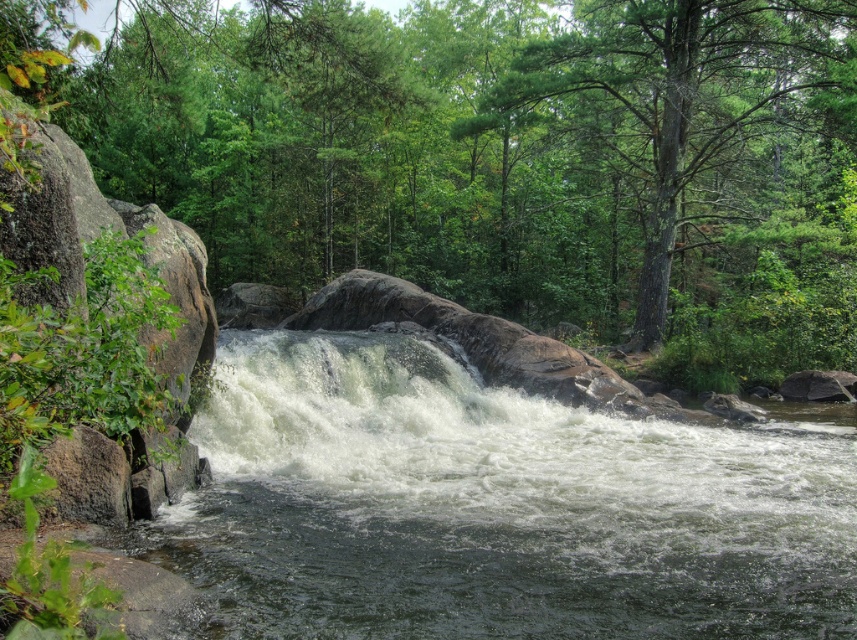
You are standing at the edge of the river and looking towards the green leafy forest at center and the green textured tree at upper center. Which one appears nearer to you?

The green leafy forest at center appears nearer to you because it is closer to the viewer than the green textured tree at upper center.

You are standing at the edge of the river in the scene and want to walk towards the two points marked in the image. Which point, point (465, 195) or point (822, 29), will you reach first?

You will reach point (465, 195) first because it is closer to you than point (822, 29), which is further away.

You are a hiker standing at the edge of the river and looking towards the center of the image. Which object is positioned higher up in the scene, the green leafy forest at center or the green textured tree at upper center?

The green textured tree at upper center is positioned higher up in the scene than the green leafy forest at center.